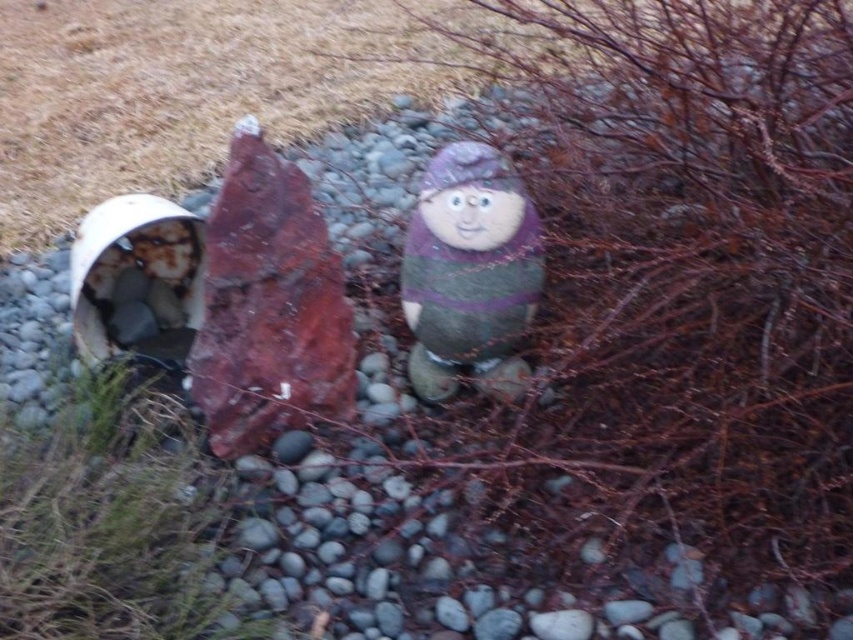
Which is below, green grass at lower left or matte painted stone figure at center?

Positioned lower is green grass at lower left.

Is the position of green grass at lower left more distant than that of matte painted stone figure at center?

No, it is not.

At what (x,y) coordinates should I click in order to perform the action: click on green grass at lower left. Please return your answer as a coordinate pair (x, y). Looking at the image, I should click on (113, 524).